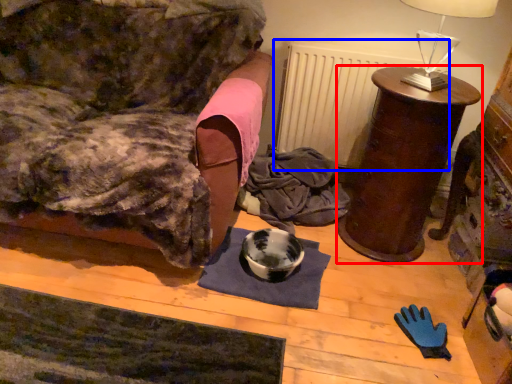
Question: Which object is further to the camera taking this photo, furniture (highlighted by a red box) or radiator (highlighted by a blue box)?

Choices:
 (A) furniture
 (B) radiator

Answer: (B)